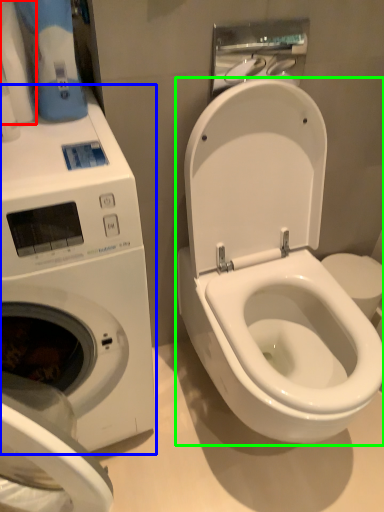
Question: Which object is the closest to the toilet paper (highlighted by a red box)? Choose among these: washing machine (highlighted by a blue box) or toilet (highlighted by a green box).

Choices:
 (A) washing machine
 (B) toilet

Answer: (A)